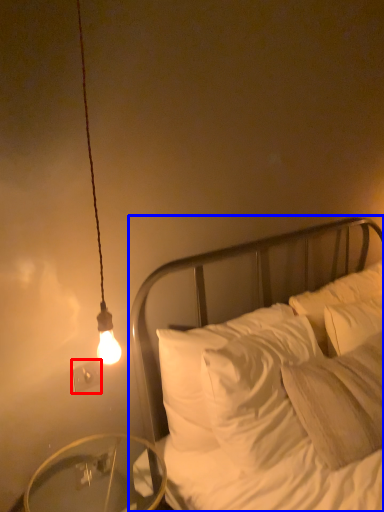
Question: Which point is closer to the camera, electric outlet (highlighted by a red box) or bed (highlighted by a blue box)?

Choices:
 (A) electric outlet
 (B) bed

Answer: (B)